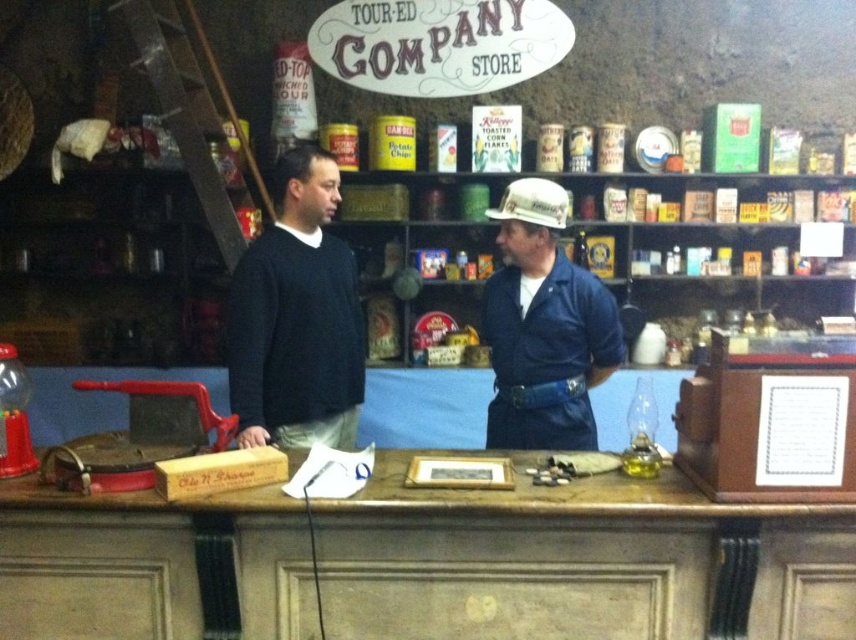
Question: Which of the following is the farthest from the observer?

Choices:
 (A) dark blue sweater at center
 (B) blue denim shirt at center

Answer: (B)

Question: Does dark blue sweater at center have a larger size compared to blue denim shirt at center?

Choices:
 (A) yes
 (B) no

Answer: (A)

Question: Can you confirm if dark blue sweater at center is bigger than blue denim shirt at center?

Choices:
 (A) no
 (B) yes

Answer: (B)

Question: Is dark blue sweater at center thinner than blue denim shirt at center?

Choices:
 (A) yes
 (B) no

Answer: (A)

Question: Which object appears closest to the camera in this image?

Choices:
 (A) blue denim shirt at center
 (B) dark blue sweater at center

Answer: (B)